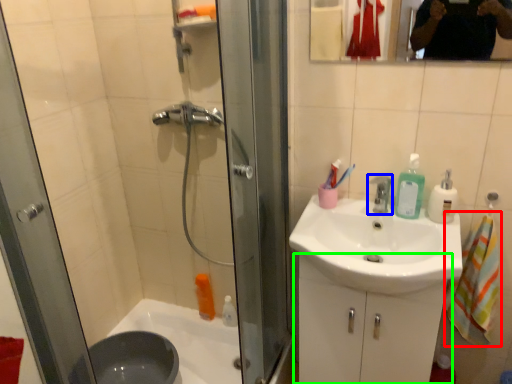
Question: Based on their relative distances, which object is nearer to bath towel (highlighted by a red box)? Choose from tap (highlighted by a blue box) and bathroom cabinet (highlighted by a green box).

Choices:
 (A) tap
 (B) bathroom cabinet

Answer: (B)